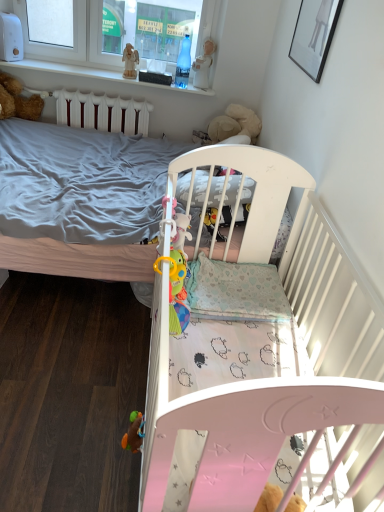
Question: Is white plastic statue at upper center, which is the second toy from bottom to top, oriented towards white plastic window frame at upper left?

Choices:
 (A) no
 (B) yes

Answer: (B)

Question: Can you confirm if white plastic statue at upper center, which appears as the 2th toy when viewed from the left, is smaller than white plastic window frame at upper left?

Choices:
 (A) yes
 (B) no

Answer: (A)

Question: Does white plastic statue at upper center, which is the second toy from bottom to top, have a lesser width compared to white plastic window frame at upper left?

Choices:
 (A) yes
 (B) no

Answer: (A)

Question: From a real-world perspective, is white plastic statue at upper center, the first toy when ordered from right to left, under white plastic window frame at upper left?

Choices:
 (A) no
 (B) yes

Answer: (B)

Question: Does white plastic statue at upper center, which is the 1th toy in top-to-bottom order, come in front of white plastic window frame at upper left?

Choices:
 (A) yes
 (B) no

Answer: (B)

Question: Considering their positions, is white plastic window frame at upper left located in front of or behind white wooden balustrade at upper center?

Choices:
 (A) front
 (B) behind

Answer: (A)

Question: Is point (196, 2) closer or farther from the camera than point (96, 70)?

Choices:
 (A) closer
 (B) farther

Answer: (A)

Question: Considering the positions of white plastic window frame at upper left and white wooden balustrade at upper center in the image, is white plastic window frame at upper left bigger or smaller than white wooden balustrade at upper center?

Choices:
 (A) small
 (B) big

Answer: (B)

Question: Choose the correct answer: Is white plastic window frame at upper left inside white wooden balustrade at upper center or outside it?

Choices:
 (A) outside
 (B) inside

Answer: (A)

Question: In the image, is white plastic window frame at upper left positioned in front of or behind white plastic statue at upper center, which is the second toy from bottom to top?

Choices:
 (A) behind
 (B) front

Answer: (B)

Question: Which is correct: white plastic window frame at upper left is inside white plastic statue at upper center, which is the 1th toy from back to front, or outside of it?

Choices:
 (A) inside
 (B) outside

Answer: (B)

Question: From their relative heights in the image, would you say white plastic window frame at upper left is taller or shorter than white plastic statue at upper center, which appears as the 2th toy when viewed from the left?

Choices:
 (A) short
 (B) tall

Answer: (B)

Question: In the image, is white plastic window frame at upper left on the left side or the right side of white plastic statue at upper center, the first toy when ordered from right to left?

Choices:
 (A) left
 (B) right

Answer: (A)

Question: From their relative heights in the image, would you say white glossy picture frame at upper right is taller or shorter than multicolored plastic toy at lower left, positioned as the 2th toy in right-to-left order?

Choices:
 (A) tall
 (B) short

Answer: (A)

Question: Looking at their shapes, would you say white glossy picture frame at upper right is wider or thinner than multicolored plastic toy at lower left, marked as the 1th toy in a left-to-right arrangement?

Choices:
 (A) wide
 (B) thin

Answer: (B)